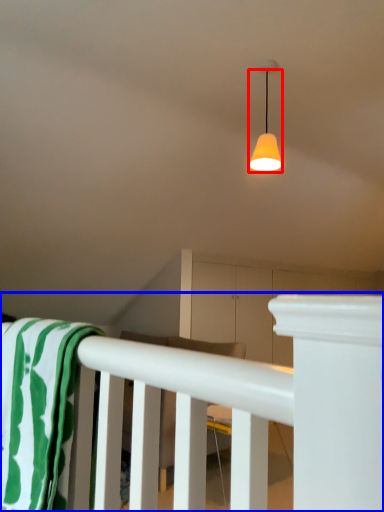
Question: Which of the following is the farthest to the observer, lamp (highlighted by a red box) or rail (highlighted by a blue box)?

Choices:
 (A) lamp
 (B) rail

Answer: (A)